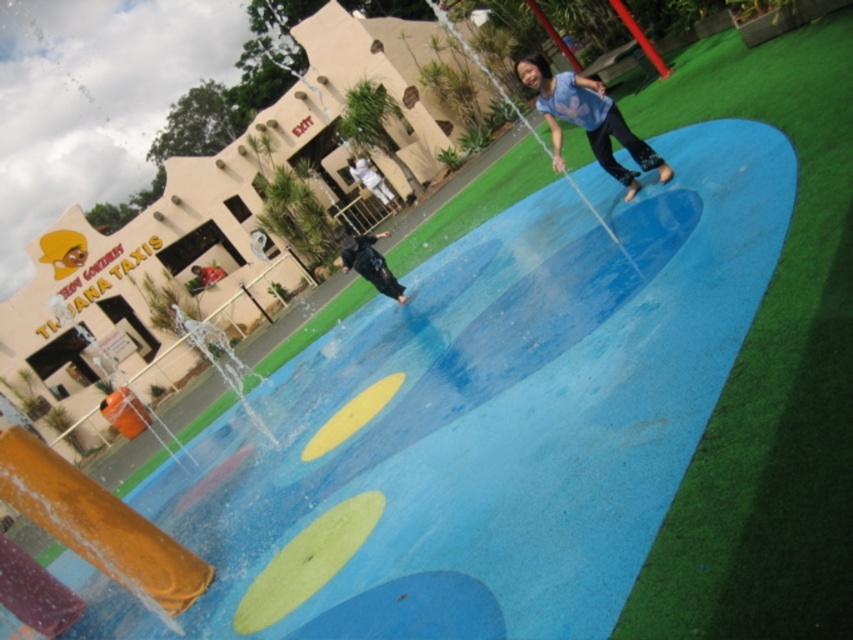
At what (x,y) coordinates should I click in order to perform the action: click on blue matte shirt at upper center. Please return your answer as a coordinate pair (x, y). This screenshot has height=640, width=853. Looking at the image, I should click on (587, 120).

Describe the element at coordinates (587, 120) in the screenshot. The image size is (853, 640). I see `blue matte shirt at upper center` at that location.

Between point (605, 131) and point (346, 266), which one is positioned behind?

The point (346, 266) is more distant.

Locate an element on the screen. The width and height of the screenshot is (853, 640). blue matte shirt at upper center is located at coordinates (587, 120).

Between blue matte shirt at upper center and dark blue fabric shirt at center, which one has more height?

With more height is dark blue fabric shirt at center.

Who is more forward, (535, 90) or (352, 177)?

Positioned in front is point (535, 90).

The height and width of the screenshot is (640, 853). I want to click on blue matte shirt at upper center, so click(x=587, y=120).

Between point (376, 253) and point (380, 182), which one is positioned behind?

The point (380, 182) is more distant.

Locate an element on the screen. black matte pants at center is located at coordinates (368, 262).

Describe the element at coordinates (368, 262) in the screenshot. The width and height of the screenshot is (853, 640). I see `black matte pants at center` at that location.

You are a GUI agent. You are given a task and a screenshot of the screen. Output one action in this format:
    pyautogui.click(x=<x>, y=<y>)
    Task: Click on the black matte pants at center
    This screenshot has height=640, width=853.
    Given the screenshot: What is the action you would take?
    pyautogui.click(x=368, y=262)